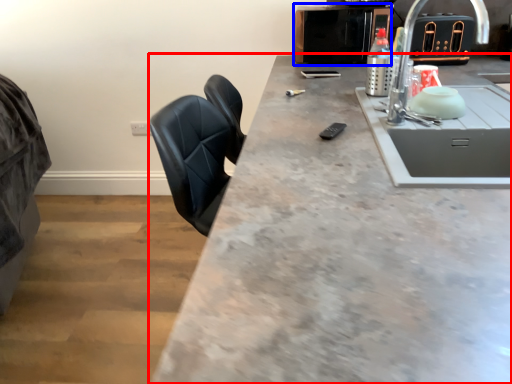
Question: Which point is further to the camera, countertop (highlighted by a red box) or appliance (highlighted by a blue box)?

Choices:
 (A) countertop
 (B) appliance

Answer: (B)